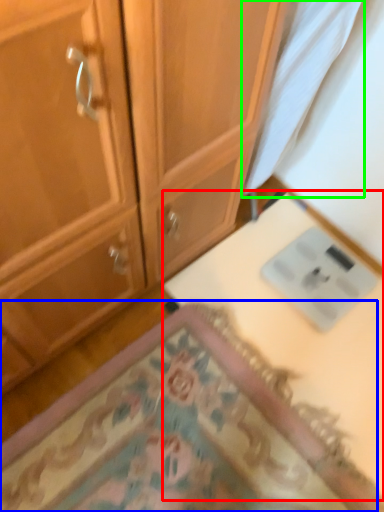
Question: Which object is the farthest from table (highlighted by a red box)? Choose among these: mat (highlighted by a blue box) or fabric (highlighted by a green box).

Choices:
 (A) mat
 (B) fabric

Answer: (B)